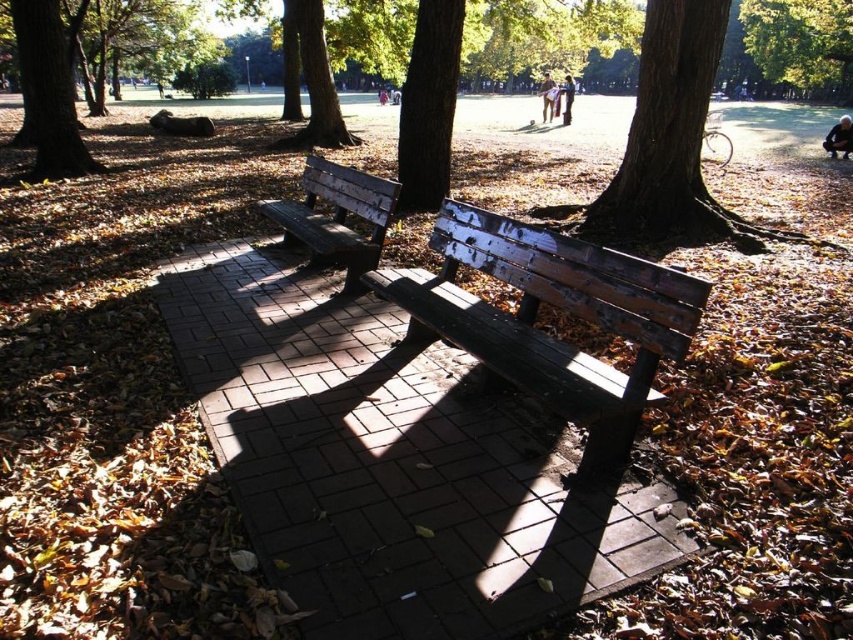
You are standing in the park and want to take a photo of both the brown rough tree at upper left and the smooth brown tree trunk at center. Which tree should you position yourself to the left of to include both in your shot?

You should position yourself to the left of the brown rough tree at upper left to capture both the brown rough tree at upper left and the smooth brown tree trunk at center in your photo since the brown rough tree at upper left is located to the left of the smooth brown tree trunk at center.

In the scene shown: You are planning to set up a picnic blanket between the brown rough bark tree at center and the light brown wooden bench at center. The picnic blanket requires a space of 15 meters between the two objects to be placed comfortably. Is there enough space between them?

The distance between the brown rough bark tree at center and the light brown wooden bench at center is 18.50 meters, which is more than the required 15 meters. Therefore, there is enough space to place the picnic blanket comfortably between them.